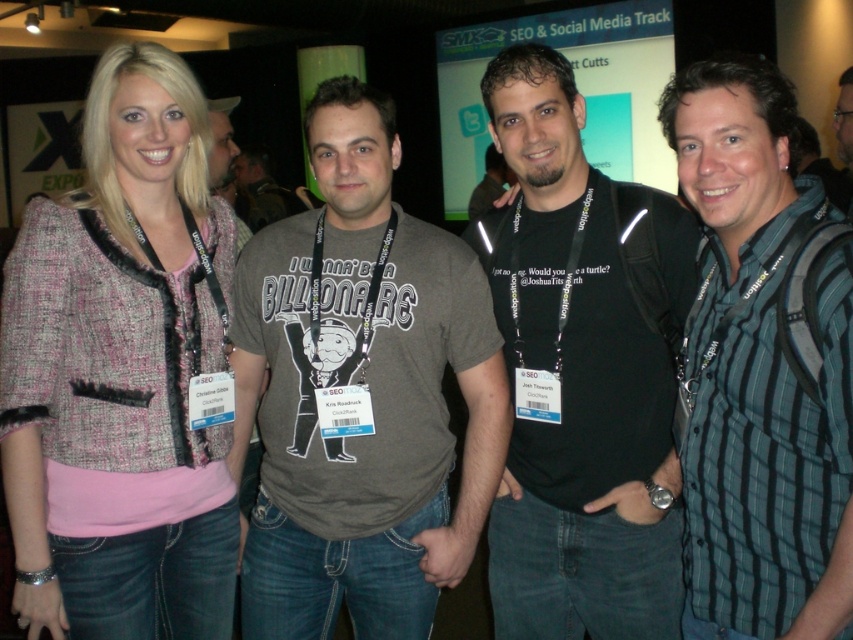
Question: Which of the following is the closest to the observer?

Choices:
 (A) matte gray t-shirt at center
 (B) striped cotton shirt at right

Answer: (B)

Question: In this image, where is matte gray t-shirt at center located relative to striped cotton shirt at right?

Choices:
 (A) above
 (B) below

Answer: (B)

Question: Which object is farther from the camera taking this photo?

Choices:
 (A) striped cotton shirt at right
 (B) matte gray t-shirt at center
 (C) pink tweed jacket at upper left

Answer: (B)

Question: Can you confirm if striped cotton shirt at right is wider than dark gray t-shirt at center?

Choices:
 (A) no
 (B) yes

Answer: (A)

Question: Can you confirm if matte gray t-shirt at center is thinner than striped cotton shirt at right?

Choices:
 (A) no
 (B) yes

Answer: (A)

Question: Based on their relative distances, which object is farther from the matte gray t-shirt at center?

Choices:
 (A) dark gray t-shirt at center
 (B) pink tweed jacket at upper left
 (C) striped cotton shirt at right

Answer: (A)